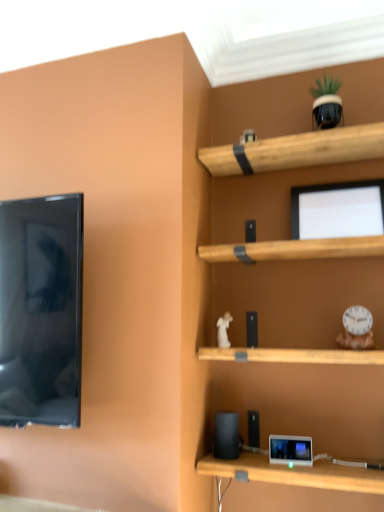
Question: Considering their positions, is white plastic clock at right, which is the first toy in right-to-left order, located in front of or behind matte black tablet at lower center?

Choices:
 (A) front
 (B) behind

Answer: (B)

Question: Considering the relative positions of white plastic clock at right, which is the first toy in right-to-left order, and matte black tablet at lower center in the image provided, is white plastic clock at right, which is the first toy in right-to-left order, to the left or to the right of matte black tablet at lower center?

Choices:
 (A) right
 (B) left

Answer: (A)

Question: Which of these objects is positioned farthest from the white glossy figurine at center, placed as the 1th toy when sorted from left to right?

Choices:
 (A) white plastic clock at right, which appears as the third toy when viewed from the left
 (B) matte black tablet at lower center
 (C) green matte plant pot at upper right, the 2th toy from the left
 (D) matte black monitor at upper center
 (E) black matte speaker at lower center

Answer: (C)

Question: Considering the real-world distances, which object is closest to the matte black tablet at lower center?

Choices:
 (A) white glossy figurine at center, which is counted as the third toy, starting from the top
 (B) black matte speaker at lower center
 (C) white plastic clock at right, which is the first toy in right-to-left order
 (D) green matte plant pot at upper right, the 1th toy when ordered from top to bottom
 (E) matte black monitor at upper center

Answer: (B)